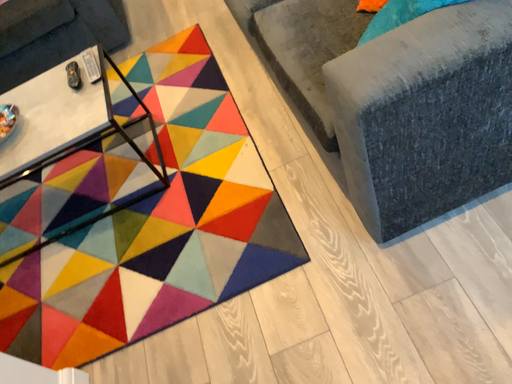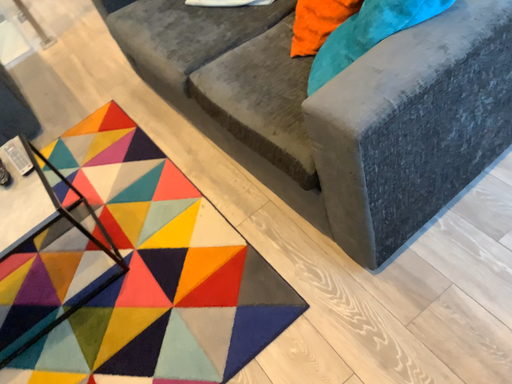
Question: How did the camera likely rotate when shooting the video?

Choices:
 (A) rotated downward
 (B) rotated upward

Answer: (B)